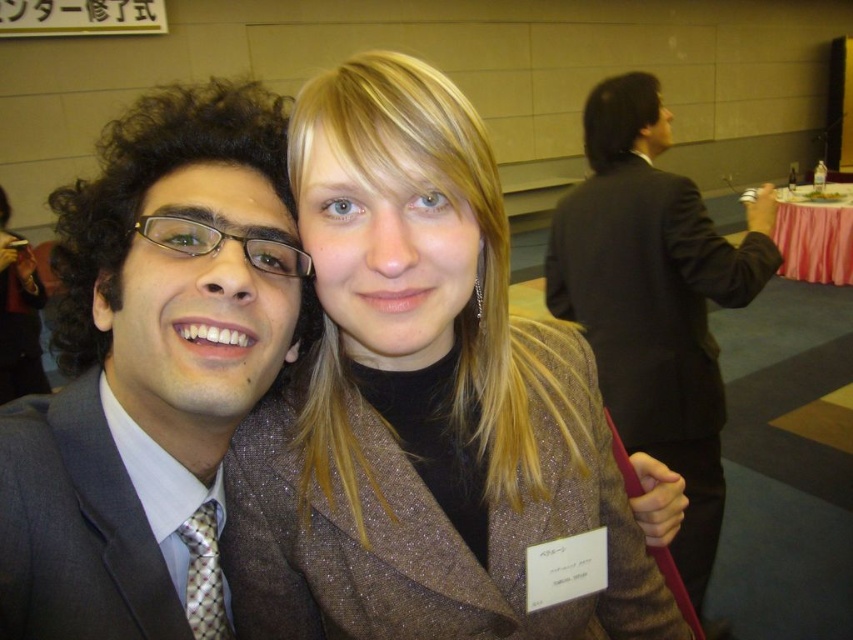
Looking at this image, is matte gray suit at left positioned before dark gray textured suit at left?

That is False.

Find the location of a particular element. The width and height of the screenshot is (853, 640). matte gray suit at left is located at coordinates (149, 358).

In order to click on matte gray suit at left in this screenshot , I will do `click(149, 358)`.

Is black suit at upper right to the right of dark gray textured suit at left from the viewer's perspective?

Correct, you'll find black suit at upper right to the right of dark gray textured suit at left.

Is black suit at upper right below dark gray textured suit at left?

Actually, black suit at upper right is above dark gray textured suit at left.

Who is more forward, [639,396] or [38,612]?

Point [38,612]

Locate an element on the screen. Image resolution: width=853 pixels, height=640 pixels. black suit at upper right is located at coordinates (654, 298).

Which is above, shiny brown coat at center or matte gray suit at left?

matte gray suit at left

Between point (235, 624) and point (67, 339), which one is positioned in front?

Point (67, 339) is in front.

At what (x,y) coordinates should I click in order to perform the action: click on shiny brown coat at center. Please return your answer as a coordinate pair (x, y). Looking at the image, I should click on (427, 406).